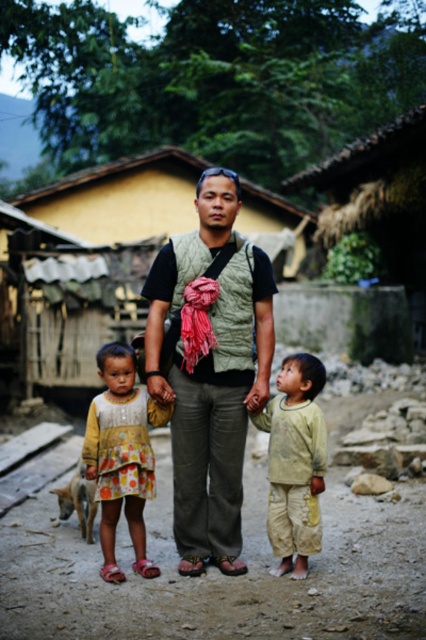
Is green textured vest at center smaller than light green fabric pants at center?

Incorrect, green textured vest at center is not smaller in size than light green fabric pants at center.

Is point (224, 376) behind point (305, 353)?

No.

Does point (261, 328) come in front of point (270, 428)?

No, (261, 328) is further to viewer.

I want to click on green textured vest at center, so click(x=212, y=374).

Can you confirm if green textured vest at center is bigger than polka dot dress at center?

Yes, green textured vest at center is bigger than polka dot dress at center.

Is point (175, 369) more distant than point (141, 488)?

Yes, it is behind point (141, 488).

Is point (215, 259) closer to viewer compared to point (124, 352)?

No, (215, 259) is further to viewer.

At what (x,y) coordinates should I click in order to perform the action: click on green textured vest at center. Please return your answer as a coordinate pair (x, y). The image size is (426, 640). Looking at the image, I should click on (212, 374).

Is polka dot dress at center taller than light green fabric pants at center?

Yes.

Does polka dot dress at center appear on the right side of light green fabric pants at center?

Incorrect, polka dot dress at center is not on the right side of light green fabric pants at center.

Is point (149, 416) closer to viewer compared to point (282, 563)?

That is False.

Identify the location of polka dot dress at center. (121, 456).